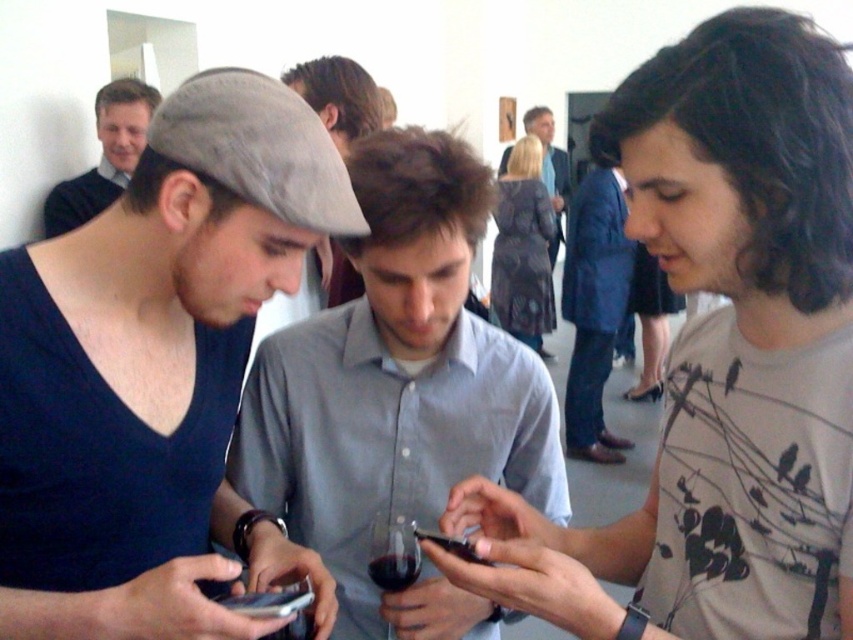
Question: From the image, what is the correct spatial relationship of transparent glass wine glass at center in relation to black glossy smartphone at center?

Choices:
 (A) above
 (B) below

Answer: (B)

Question: Considering the relative positions of gray matte shirt at center and matte gray cap at center in the image provided, where is gray matte shirt at center located with respect to matte gray cap at center?

Choices:
 (A) left
 (B) right

Answer: (B)

Question: Estimate the real-world distances between objects in this image. Which object is closer to the transparent glass wine glass at center?

Choices:
 (A) light gray shirt at center
 (B) matte black sweater at upper left
 (C) dark red glass at center
 (D) matte gray cap at center

Answer: (C)

Question: Considering the real-world distances, which object is closest to the gray matte shirt at center?

Choices:
 (A) matte black sweater at upper left
 (B) matte gray cap at center
 (C) black glossy smartphone at center
 (D) light gray shirt at center

Answer: (C)

Question: Is gray matte shirt at center smaller than light gray shirt at center?

Choices:
 (A) yes
 (B) no

Answer: (A)

Question: Among these points, which one is nearest to the camera?

Choices:
 (A) (260, 474)
 (B) (381, 561)

Answer: (B)